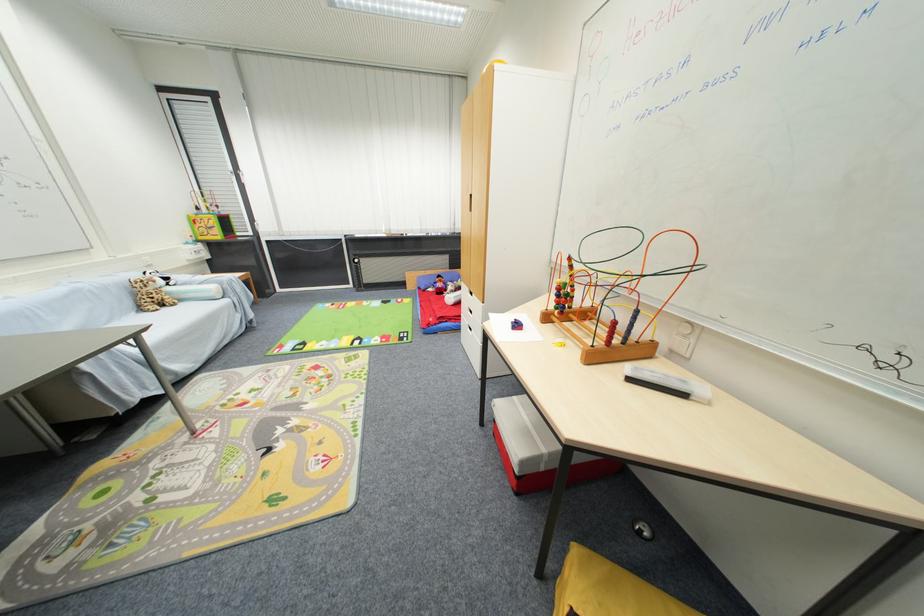
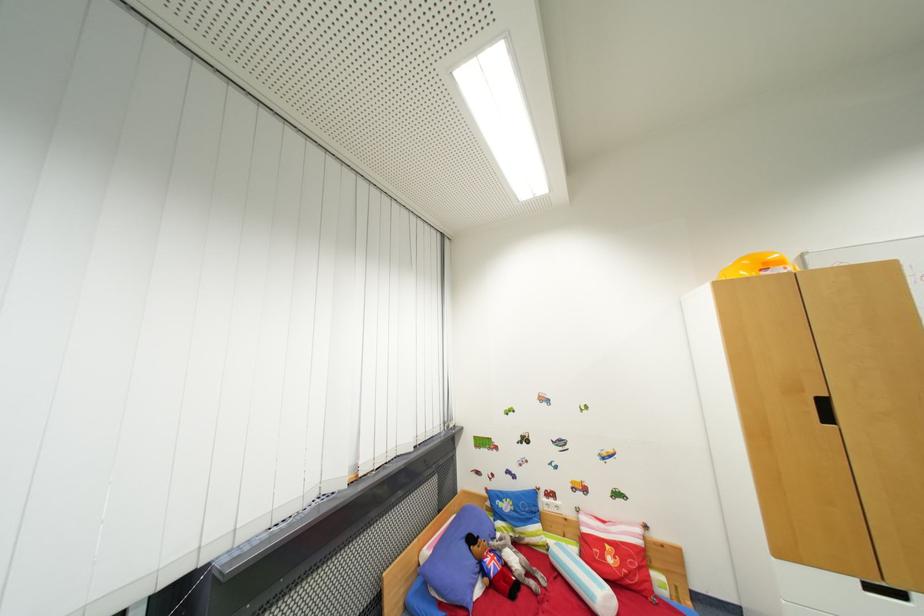
The point at (444,278) is marked in the first image. Where is the corresponding point in the second image?

(477, 541)